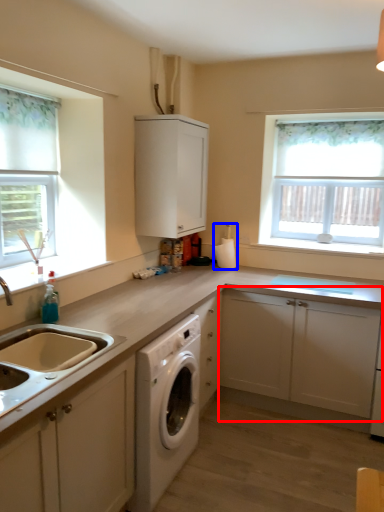
Question: Which object appears closest to the camera in this image, cabinetry (highlighted by a red box) or appliance (highlighted by a blue box)?

Choices:
 (A) cabinetry
 (B) appliance

Answer: (A)